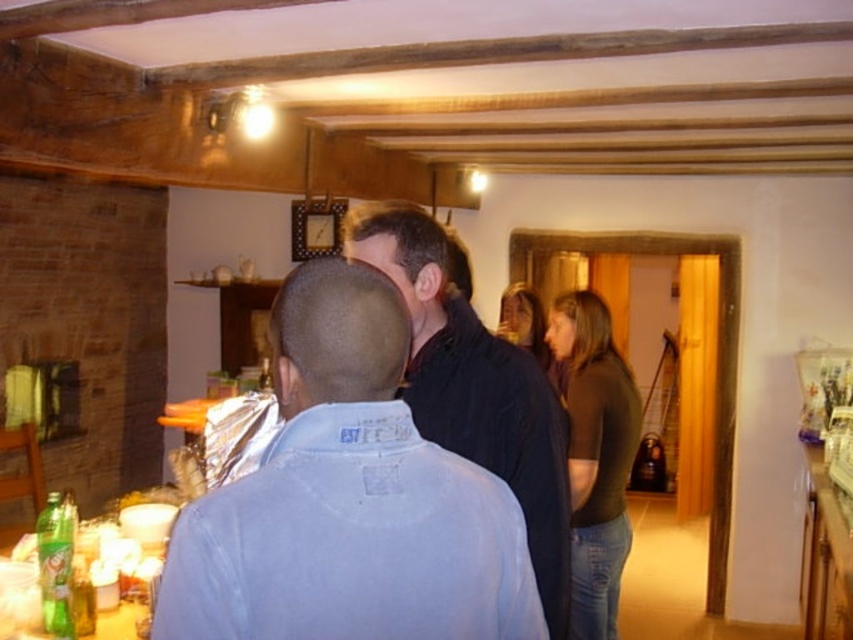
Question: Can you confirm if black matte jacket at center is bigger than green glass bottle at lower left?

Choices:
 (A) no
 (B) yes

Answer: (B)

Question: Does light blue shirt at center appear on the right side of black matte jacket at center?

Choices:
 (A) no
 (B) yes

Answer: (A)

Question: Which of the following is the closest to the observer?

Choices:
 (A) pyautogui.click(x=45, y=525)
 (B) pyautogui.click(x=415, y=324)

Answer: (B)

Question: Which point is closer to the camera?

Choices:
 (A) light blue shirt at center
 (B) black matte jacket at center
 (C) green glass bottle at lower left

Answer: (A)

Question: Does light blue shirt at center have a smaller size compared to black matte jacket at center?

Choices:
 (A) no
 (B) yes

Answer: (B)

Question: Which point is closer to the camera taking this photo?

Choices:
 (A) (425, 307)
 (B) (485, 584)

Answer: (B)